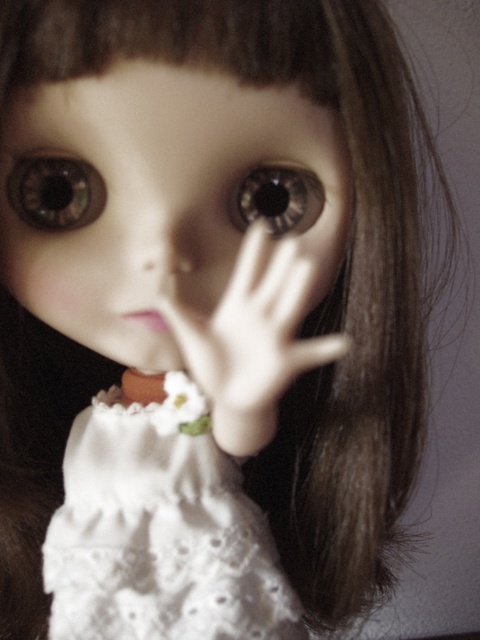
Does matte porcelain doll face at center have a greater height compared to brown glossy eye at upper left?

Indeed, matte porcelain doll face at center has a greater height compared to brown glossy eye at upper left.

Is matte porcelain doll face at center positioned at the back of brown glossy eye at upper left?

No, it is in front of brown glossy eye at upper left.

Locate an element on the screen. This screenshot has width=480, height=640. matte porcelain doll face at center is located at coordinates (156, 195).

The width and height of the screenshot is (480, 640). Describe the element at coordinates (156, 195) in the screenshot. I see `matte porcelain doll face at center` at that location.

Consider the image. Is matte porcelain doll face at center positioned before white lace dress at center?

That is True.

Between point (55, 234) and point (119, 512), which one is positioned behind?

The point (119, 512) is behind.

The image size is (480, 640). Identify the location of matte porcelain doll face at center. (156, 195).

Is white lace dress at center above brown glossy eye at center?

No, white lace dress at center is not above brown glossy eye at center.

Looking at this image, does white lace dress at center come in front of brown glossy eye at center?

No.

The height and width of the screenshot is (640, 480). In order to click on white lace dress at center in this screenshot , I will do `click(159, 531)`.